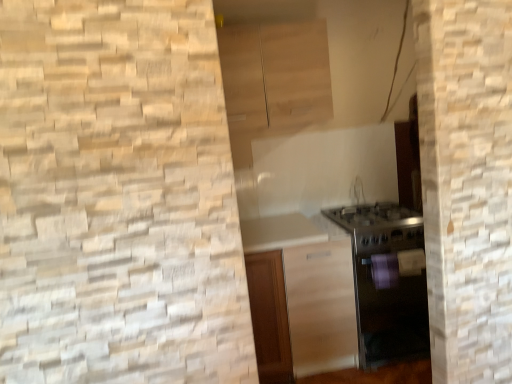
Question: From a real-world perspective, relative to satin silver oven at lower right, is light wood cabinet at upper center, acting as the first cabinetry starting from the top, vertically above or below?

Choices:
 (A) above
 (B) below

Answer: (A)

Question: Is light wood cabinet at upper center, acting as the first cabinetry starting from the top, wider or thinner than satin silver oven at lower right?

Choices:
 (A) thin
 (B) wide

Answer: (A)

Question: Which of these objects is positioned farthest from the light wood cabinet at upper center, which appears as the second cabinetry when ordered from the bottom?

Choices:
 (A) satin wood cabinet at center, placed as the first cabinetry when sorted from bottom to top
 (B) satin silver oven at lower right

Answer: (A)

Question: Based on their relative distances, which object is farther from the satin wood cabinet at center, marked as the second cabinetry in a top-to-bottom arrangement?

Choices:
 (A) light wood cabinet at upper center, acting as the first cabinetry starting from the top
 (B) satin silver oven at lower right

Answer: (A)